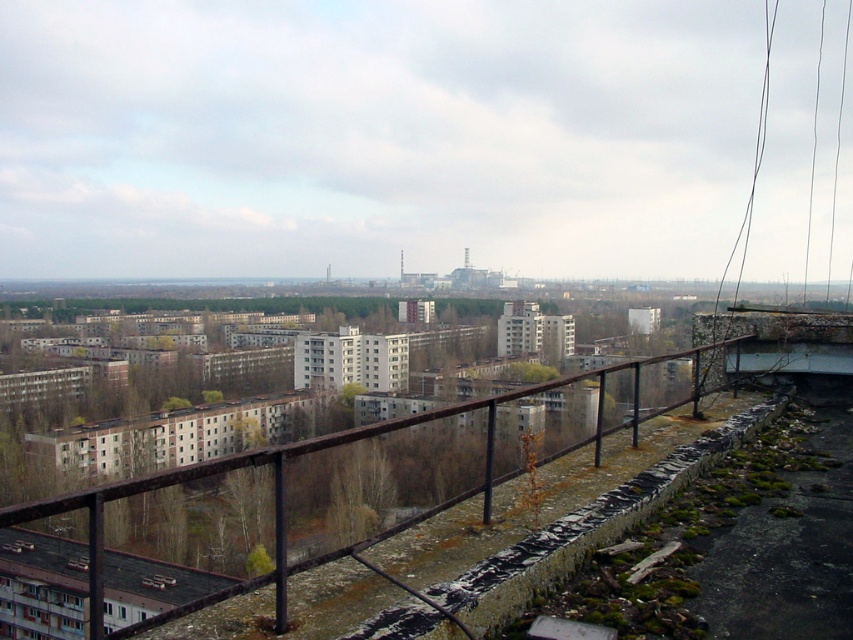
Question: Does rusty metal railing at center appear over black wire at upper right?

Choices:
 (A) yes
 (B) no

Answer: (B)

Question: Is rusty metal railing at center positioned before black wire at upper right?

Choices:
 (A) yes
 (B) no

Answer: (A)

Question: Does rusty metal railing at center come in front of black wire at upper right?

Choices:
 (A) no
 (B) yes

Answer: (B)

Question: Which point appears farthest from the camera in this image?

Choices:
 (A) (717, 337)
 (B) (299, 449)

Answer: (A)